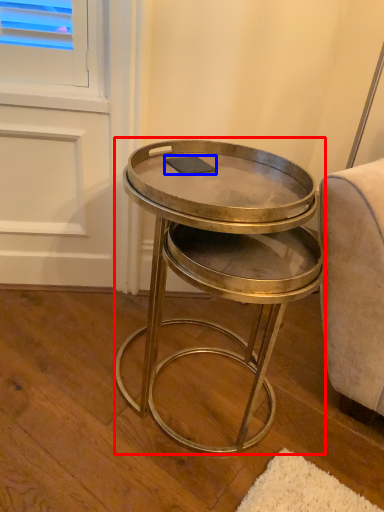
Question: Which point is closer to the camera, coffee table (highlighted by a red box) or pad (highlighted by a blue box)?

Choices:
 (A) coffee table
 (B) pad

Answer: (A)